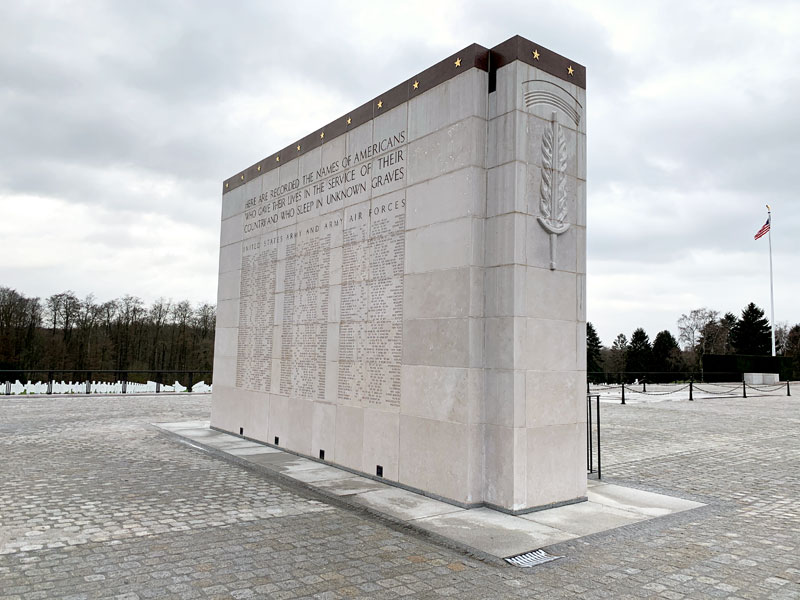
At what (x,y) coordinates should I click in order to perform the action: click on drain. Please return your answer as a coordinate pair (x, y). This screenshot has width=800, height=600. Looking at the image, I should click on (538, 559).